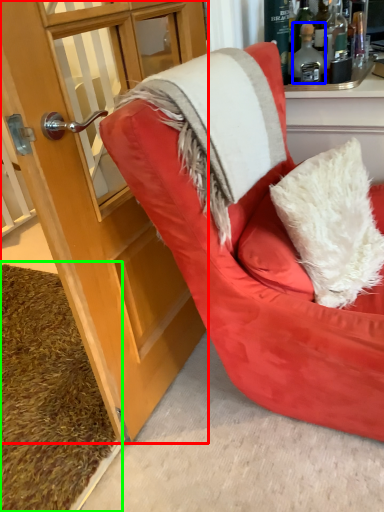
Question: Which object is the farthest from cabinetry (highlighted by a red box)? Choose among these: bottle (highlighted by a blue box) or doormat (highlighted by a green box).

Choices:
 (A) bottle
 (B) doormat

Answer: (A)